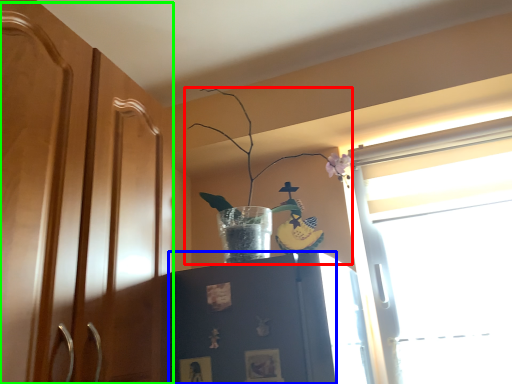
Question: Which is nearer to the houseplant (highlighted by a red box)? cabinetry (highlighted by a blue box) or dresser (highlighted by a green box).

Choices:
 (A) cabinetry
 (B) dresser

Answer: (A)